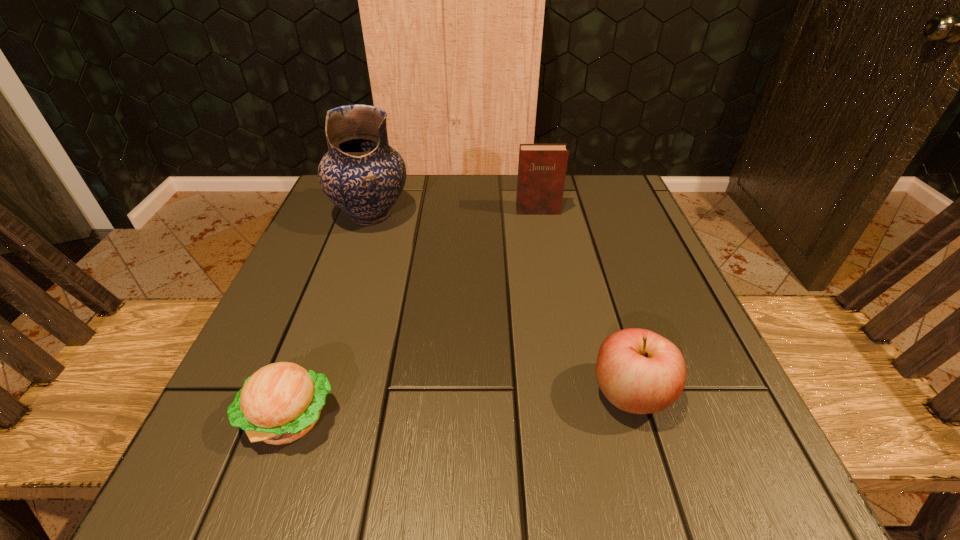
This screenshot has width=960, height=540. Find the location of `vacant area that lies between the diary and the shortest object`. vacant area that lies between the diary and the shortest object is located at coordinates (414, 314).

You are a GUI agent. You are given a task and a screenshot of the screen. Output one action in this format:
    pyautogui.click(x=<x>, y=<y>)
    Task: Click on the vacant space in between the third tallest object and the shortest object
    The image size is (960, 540).
    Given the screenshot: What is the action you would take?
    pyautogui.click(x=461, y=406)

This screenshot has width=960, height=540. I want to click on free space between the pottery and the shortest object, so click(330, 316).

Locate an element on the screen. The height and width of the screenshot is (540, 960). the third closest object to the pottery is located at coordinates (639, 371).

Identify the location of object identified as the second closest to the shortest object. (361, 174).

You are a GUI agent. You are given a task and a screenshot of the screen. Output one action in this format:
    pyautogui.click(x=<x>, y=<y>)
    Task: Click on the vacant space that satisfies the following two spatial constraints: 1. on the front cover of the apple; 2. on the right side of the third shortest object
    The width and height of the screenshot is (960, 540).
    Given the screenshot: What is the action you would take?
    pyautogui.click(x=570, y=394)

Identify the location of vacant space that satisfies the following two spatial constraints: 1. on the back side of the pottery; 2. on the left side of the shortest object. click(363, 214).

This screenshot has height=540, width=960. Find the location of `free space that satisfies the following two spatial constraints: 1. on the front cover of the third shortest object; 2. on the left side of the apple`. free space that satisfies the following two spatial constraints: 1. on the front cover of the third shortest object; 2. on the left side of the apple is located at coordinates click(570, 394).

You are a GUI agent. You are given a task and a screenshot of the screen. Output one action in this format:
    pyautogui.click(x=<x>, y=<y>)
    Task: Click on the vacant region that satisfies the following two spatial constraints: 1. on the back side of the third tallest object; 2. on the left side of the hamburger
    
    Given the screenshot: What is the action you would take?
    pyautogui.click(x=299, y=394)